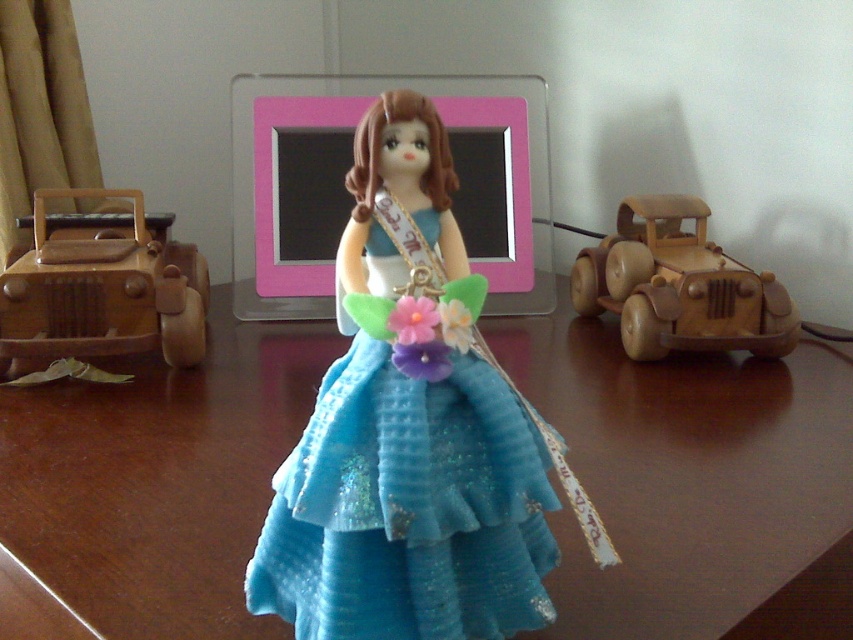
Question: Considering the real-world distances, which object is farthest from the glittery blue fabric dress at center?

Choices:
 (A) wooden table at center
 (B) wooden car at right
 (C) wooden toy car at left

Answer: (B)

Question: From the image, what is the correct spatial relationship of glittery blue fabric dress at center in relation to wooden car at right?

Choices:
 (A) left
 (B) right

Answer: (A)

Question: Does wooden table at center have a larger size compared to wooden toy car at left?

Choices:
 (A) no
 (B) yes

Answer: (B)

Question: Can you confirm if wooden table at center is wider than wooden car at right?

Choices:
 (A) no
 (B) yes

Answer: (B)

Question: Which is nearer to the wooden toy car at left?

Choices:
 (A) glittery blue fabric dress at center
 (B) wooden car at right
 (C) wooden table at center

Answer: (C)

Question: Which object appears farthest from the camera in this image?

Choices:
 (A) wooden table at center
 (B) wooden car at right
 (C) glittery blue fabric dress at center

Answer: (B)